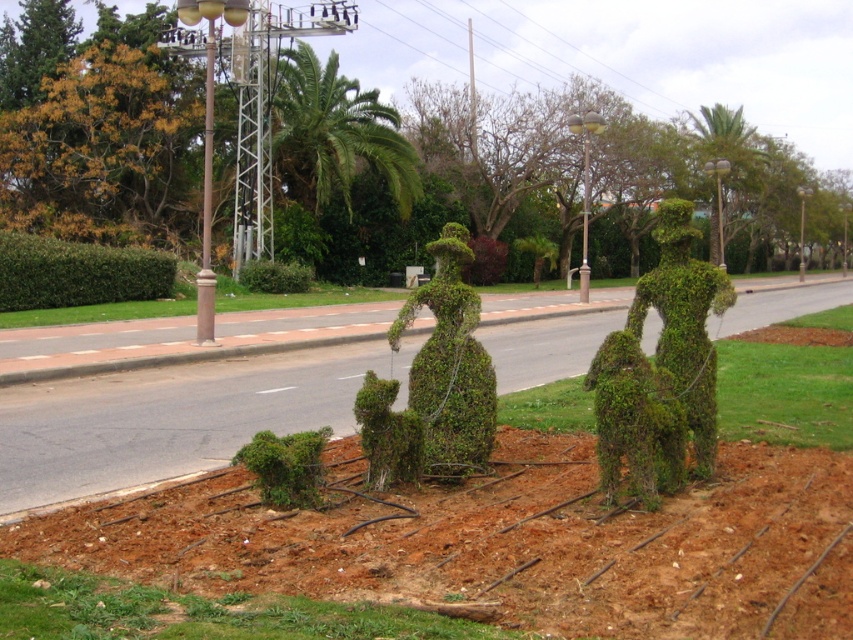
Is green grass at lower left to the right of green leafy bush at center from the viewer's perspective?

Yes, green grass at lower left is to the right of green leafy bush at center.

Which is above, green grass at lower left or green leafy bush at center?

green leafy bush at center

Does point (67, 600) come farther from viewer compared to point (263, 273)?

No.

Find the location of a particular element. green grass at lower left is located at coordinates (196, 612).

Does green grass at lower left appear over green leafy hedge at left?

Incorrect, green grass at lower left is not positioned above green leafy hedge at left.

Is green grass at lower left closer to camera compared to green leafy hedge at left?

Yes, green grass at lower left is in front of green leafy hedge at left.

Does point (36, 636) come closer to viewer compared to point (59, 301)?

Yes, point (36, 636) is in front of point (59, 301).

This screenshot has height=640, width=853. Find the location of `green grass at lower left`. green grass at lower left is located at coordinates (196, 612).

Can you confirm if green leafy bush at lower left is bigger than green leafy bush at center?

No, green leafy bush at lower left is not bigger than green leafy bush at center.

Which of these two, green leafy bush at lower left or green leafy bush at center, stands shorter?

green leafy bush at lower left

Locate an element on the screen. The width and height of the screenshot is (853, 640). green leafy bush at lower left is located at coordinates (285, 467).